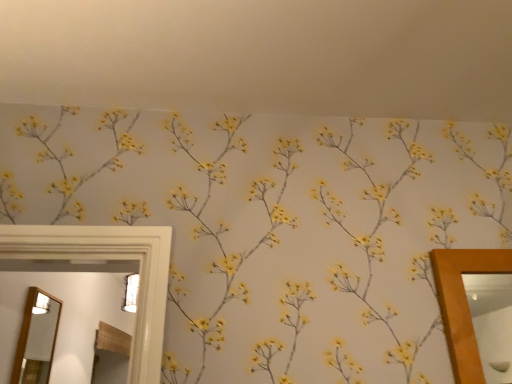
In order to face matte wooden mirror at left, should I rotate leftwards or rightwards?

Answer: It's best to rotate left around 26.602 degrees.

The width and height of the screenshot is (512, 384). What do you see at coordinates (37, 338) in the screenshot?
I see `matte wooden mirror at left` at bounding box center [37, 338].

Measure the distance between matte wooden mirror at left and camera.

matte wooden mirror at left is 2.02 meters from camera.

You are a GUI agent. You are given a task and a screenshot of the screen. Output one action in this format:
    pyautogui.click(x=<x>, y=<y>)
    Task: Click on the matte wooden mirror at left
    
    Given the screenshot: What is the action you would take?
    pyautogui.click(x=37, y=338)

Identify the location of matte wooden mirror at left. The image size is (512, 384). (37, 338).